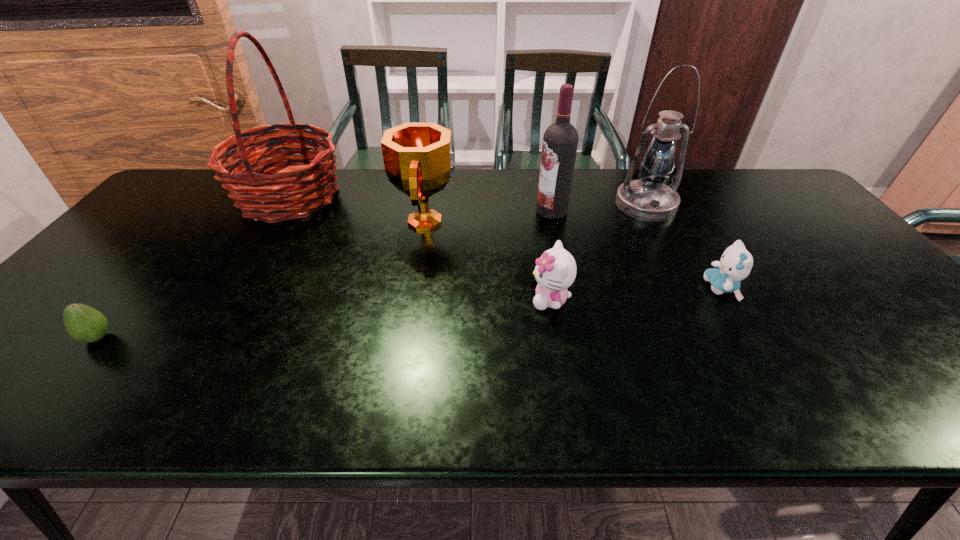
Where is `the second object from left to right`? The height and width of the screenshot is (540, 960). the second object from left to right is located at coordinates tap(304, 188).

Find the location of a particular element. The width and height of the screenshot is (960, 540). oil lamp is located at coordinates (649, 199).

Identify the location of wine bottle. This screenshot has width=960, height=540. (560, 140).

This screenshot has height=540, width=960. I want to click on the fourth shortest object, so click(418, 159).

Image resolution: width=960 pixels, height=540 pixels. In order to click on the third object from left to right in this screenshot , I will do `click(418, 159)`.

Where is `the left kitten`? the left kitten is located at coordinates (555, 271).

At what (x,y) coordinates should I click in order to perform the action: click on the right kitten. Please return your answer as a coordinate pair (x, y). This screenshot has width=960, height=540. Looking at the image, I should click on (736, 262).

Find the location of a particular element. the shorter kitten is located at coordinates (736, 262).

Locate an element on the screen. The height and width of the screenshot is (540, 960). the shortest object is located at coordinates (82, 322).

The height and width of the screenshot is (540, 960). Identify the location of avocado. pos(82,322).